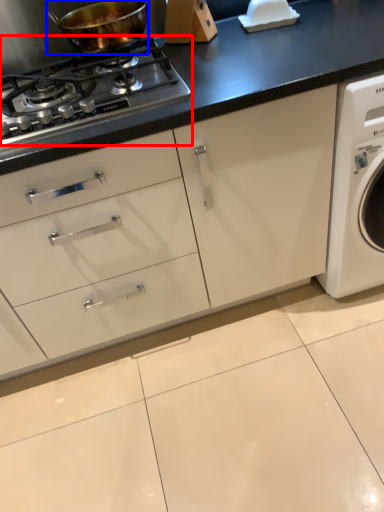
Question: Among these objects, which one is nearest to the camera, gas stove (highlighted by a red box) or kitchen appliance (highlighted by a blue box)?

Choices:
 (A) gas stove
 (B) kitchen appliance

Answer: (A)